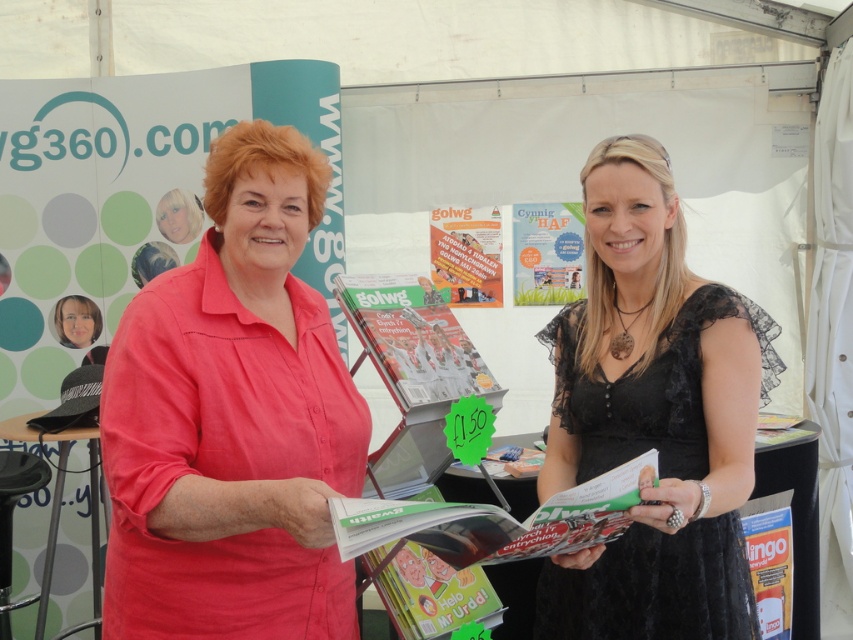
Question: Which point is closer to the camera?

Choices:
 (A) (171, 568)
 (B) (717, 566)

Answer: (A)

Question: Does pink cotton shirt at center come in front of black lace dress at center?

Choices:
 (A) no
 (B) yes

Answer: (B)

Question: Which point is farther to the camera?

Choices:
 (A) (264, 516)
 (B) (698, 372)

Answer: (B)

Question: Is pink cotton shirt at center further to the viewer compared to black lace dress at center?

Choices:
 (A) no
 (B) yes

Answer: (A)

Question: Which point is farther from the camera taking this photo?

Choices:
 (A) (270, 404)
 (B) (671, 358)

Answer: (B)

Question: Is pink cotton shirt at center bigger than black lace dress at center?

Choices:
 (A) no
 (B) yes

Answer: (A)